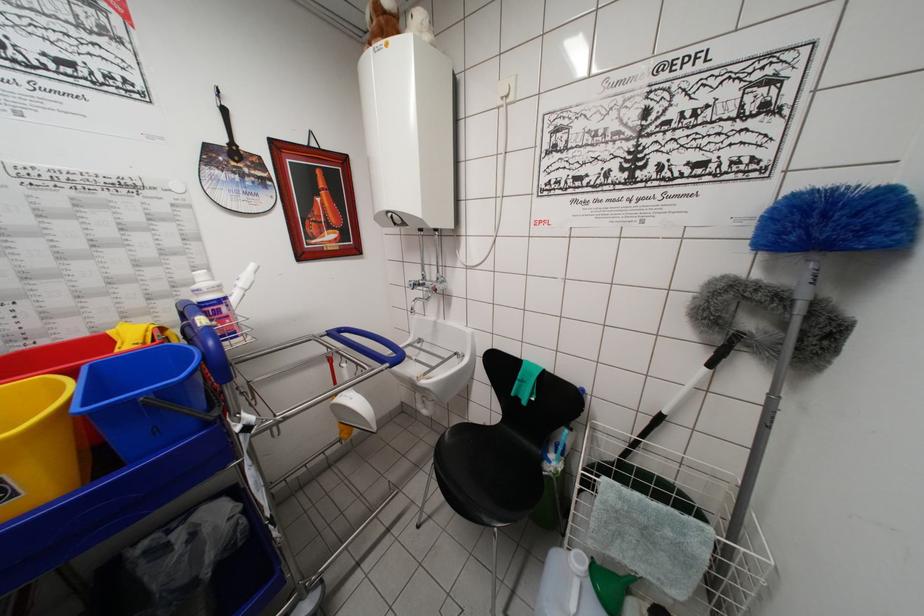
Image resolution: width=924 pixels, height=616 pixels. I want to click on blue cart handle, so click(x=211, y=353).